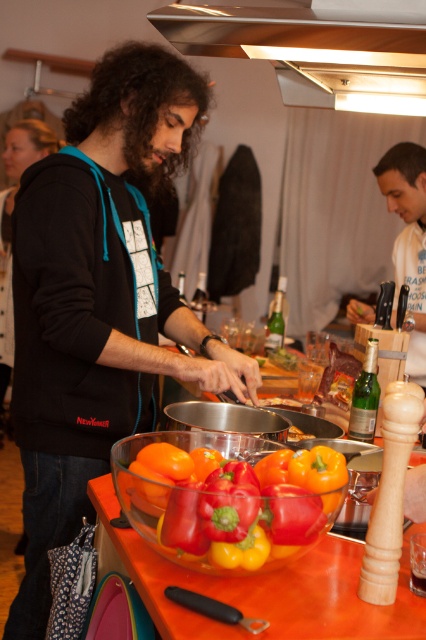
Between shiny glass bowl at center and white cotton shirt at upper right, which one is positioned higher?

white cotton shirt at upper right is higher up.

You are a GUI agent. You are given a task and a screenshot of the screen. Output one action in this format:
    pyautogui.click(x=<x>, y=<y>)
    Task: Click on the shiny glass bowl at center
    
    Given the screenshot: What is the action you would take?
    pyautogui.click(x=221, y=500)

Where is `shiny glass bowl at center`? shiny glass bowl at center is located at coordinates (221, 500).

Looking at this image, does black matte hoodie at center have a smaller size compared to white cotton shirt at upper right?

No.

Locate an element on the screen. The height and width of the screenshot is (640, 426). black matte hoodie at center is located at coordinates (100, 300).

This screenshot has height=640, width=426. Identify the location of black matte hoodie at center. (100, 300).

Does black matte hoodie at center appear over translucent glass bowl at center?

Yes.

Is black matte hoodie at center shorter than translucent glass bowl at center?

In fact, black matte hoodie at center may be taller than translucent glass bowl at center.

Does point (36, 486) lie behind point (356, 547)?

Yes.

Where is `black matte hoodie at center`? The width and height of the screenshot is (426, 640). black matte hoodie at center is located at coordinates (100, 300).